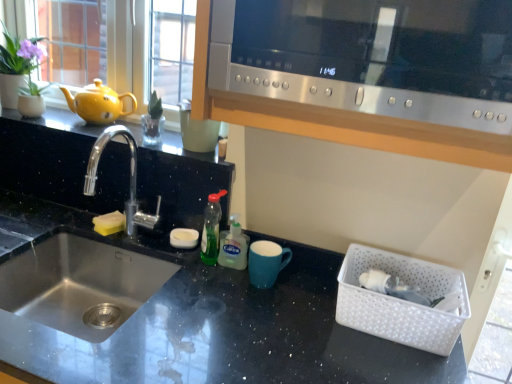
Find the location of a particular element. The height and width of the screenshot is (384, 512). free location in front of green translucent soap dispenser at center, which appears as the 2th bottle when viewed from the left is located at coordinates (226, 296).